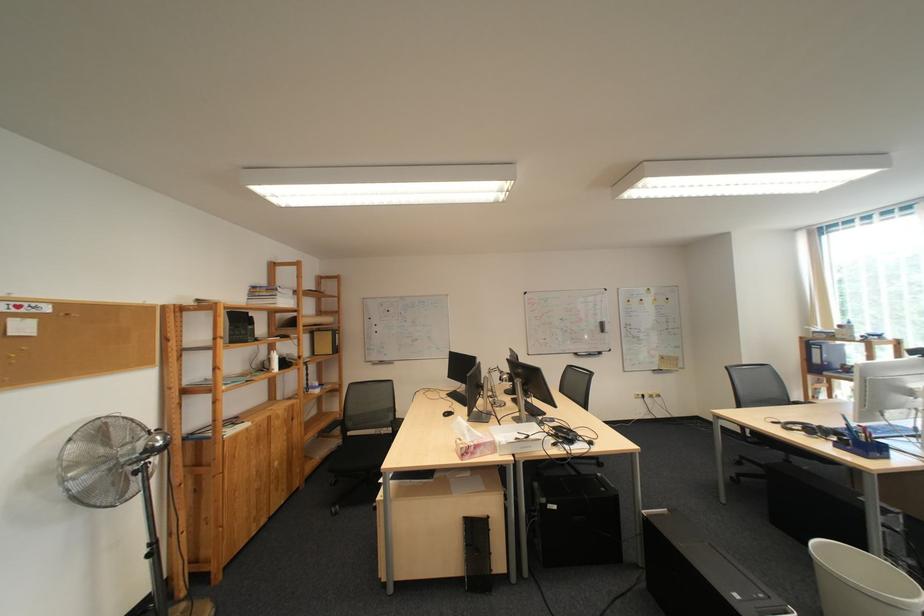
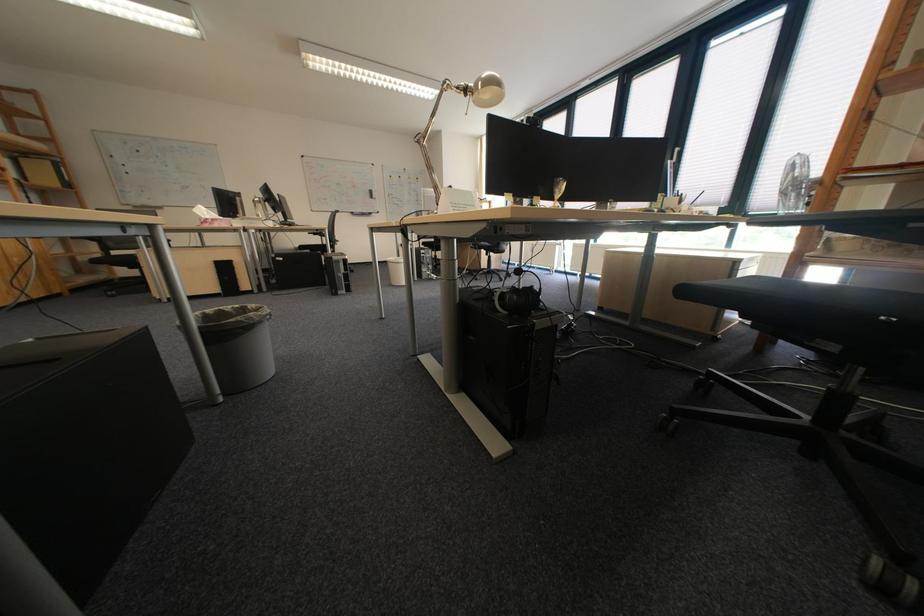
Where in the second image is the point corresponding to [487,455] from the first image?

(225, 225)